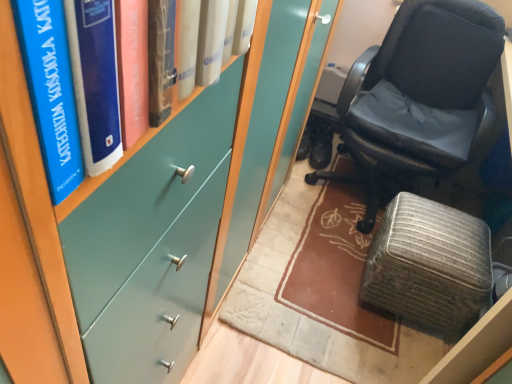
Locate an element on the screen. Image resolution: width=512 pixels, height=384 pixels. free space in front of black leather shoes at center is located at coordinates (321, 177).